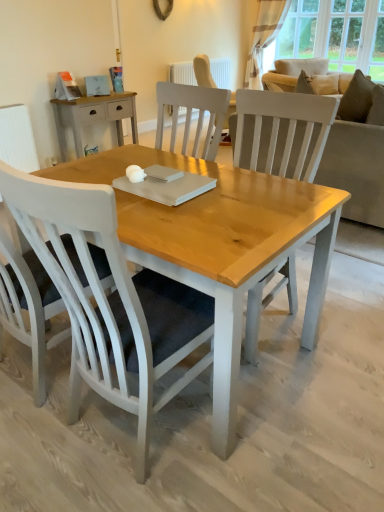
The width and height of the screenshot is (384, 512). Describe the element at coordinates (110, 300) in the screenshot. I see `white painted wood chair at center, arranged as the 1th chair when viewed from the right` at that location.

This screenshot has width=384, height=512. Describe the element at coordinates (358, 164) in the screenshot. I see `light beige fabric couch at upper right` at that location.

Describe the element at coordinates (29, 306) in the screenshot. This screenshot has width=384, height=512. I see `white painted wood chair at left, arranged as the 2th chair when viewed from the right` at that location.

Based on the photo, in order to face suede-like beige pillow at upper right, should I rotate leftwards or rightwards?

To align with it, rotate right about 22.322°.

The image size is (384, 512). What are the coordinates of `light brown wood desk at upper left` in the screenshot? It's located at (93, 117).

I want to click on white painted wood chair at center, marked as the 2th chair in a left-to-right arrangement, so click(x=110, y=300).

Looking at this image, from a real-world perspective, relative to white painted radiator at upper center, is striped fabric curtain at upper right vertically above or below?

striped fabric curtain at upper right is situated higher than white painted radiator at upper center in the real world.

From the image's perspective, is striped fabric curtain at upper right above white painted radiator at upper center?

Yes.

Is striped fabric curtain at upper right in front of or behind white painted radiator at upper center in the image?

striped fabric curtain at upper right is positioned farther from the viewer than white painted radiator at upper center.

Looking at this image, can you confirm if striped fabric curtain at upper right is shorter than white painted radiator at upper center?

In fact, striped fabric curtain at upper right may be taller than white painted radiator at upper center.

Is white painted wood chair at left, arranged as the 2th chair when viewed from the right, aimed at light beige fabric couch at upper right?

Yes, white painted wood chair at left, arranged as the 2th chair when viewed from the right, faces towards light beige fabric couch at upper right.

Is white painted wood chair at left, arranged as the 2th chair when viewed from the right, in front of or behind light beige fabric couch at upper right in the image?

white painted wood chair at left, arranged as the 2th chair when viewed from the right, is positioned closer to the viewer than light beige fabric couch at upper right.

Between white painted wood chair at left, the 1th chair viewed from the left, and light beige fabric couch at upper right, which one has less height?

Standing shorter between the two is light beige fabric couch at upper right.

Is white painted wood chair at left, arranged as the 2th chair when viewed from the right, inside the boundaries of light beige fabric couch at upper right, or outside?

white painted wood chair at left, arranged as the 2th chair when viewed from the right, lies outside light beige fabric couch at upper right.

How distant is light brown wood desk at upper left from striped fabric curtain at upper right?

light brown wood desk at upper left is 3.23 meters away from striped fabric curtain at upper right.

Is light brown wood desk at upper left not inside striped fabric curtain at upper right?

Yes, light brown wood desk at upper left is located beyond the bounds of striped fabric curtain at upper right.

Which point is more distant from viewer, [122,143] or [281,12]?

The point [281,12] is behind.

Considering the relative positions of light brown wood desk at upper left and striped fabric curtain at upper right in the image provided, is light brown wood desk at upper left to the left or to the right of striped fabric curtain at upper right?

light brown wood desk at upper left is positioned on striped fabric curtain at upper right's left side.

Consider the image. Is white painted wood chair at center, arranged as the 1th chair when viewed from the right, not close to suede-like beige pillow at upper right?

white painted wood chair at center, arranged as the 1th chair when viewed from the right, is far away from suede-like beige pillow at upper right.

Between white painted wood chair at center, marked as the 2th chair in a left-to-right arrangement, and suede-like beige pillow at upper right, which one has larger width?

white painted wood chair at center, marked as the 2th chair in a left-to-right arrangement.

Is point (49, 213) behind point (364, 81)?

No, (49, 213) is closer to viewer.

Who is bigger, white painted wood chair at center, marked as the 2th chair in a left-to-right arrangement, or suede-like beige pillow at upper right?

With larger size is white painted wood chair at center, marked as the 2th chair in a left-to-right arrangement.

Considering the relative sizes of light brown wood desk at upper left and white painted wood chair at center, marked as the 2th chair in a left-to-right arrangement, in the image provided, is light brown wood desk at upper left bigger than white painted wood chair at center, marked as the 2th chair in a left-to-right arrangement,?

No.

Do you think light brown wood desk at upper left is within white painted wood chair at center, marked as the 2th chair in a left-to-right arrangement, or outside of it?

light brown wood desk at upper left lies outside white painted wood chair at center, marked as the 2th chair in a left-to-right arrangement.

Considering the relative sizes of light brown wood desk at upper left and white painted wood chair at center, marked as the 2th chair in a left-to-right arrangement, in the image provided, is light brown wood desk at upper left taller than white painted wood chair at center, marked as the 2th chair in a left-to-right arrangement,?

In fact, light brown wood desk at upper left may be shorter than white painted wood chair at center, marked as the 2th chair in a left-to-right arrangement.

Is light brown wood desk at upper left not close to white painted wood chair at center, marked as the 2th chair in a left-to-right arrangement?

light brown wood desk at upper left is positioned a significant distance from white painted wood chair at center, marked as the 2th chair in a left-to-right arrangement.

In the scene shown: Between striped fabric curtain at upper right and white painted wood chair at center, marked as the 2th chair in a left-to-right arrangement, which one is positioned behind?

striped fabric curtain at upper right.

From a real-world perspective, is striped fabric curtain at upper right under white painted wood chair at center, arranged as the 1th chair when viewed from the right?

Actually, striped fabric curtain at upper right is physically above white painted wood chair at center, arranged as the 1th chair when viewed from the right, in the real world.

Which point is more distant from viewer, (270,19) or (69,229)?

Positioned behind is point (270,19).

Is striped fabric curtain at upper right taller than white painted wood chair at center, marked as the 2th chair in a left-to-right arrangement?

Yes, striped fabric curtain at upper right is taller than white painted wood chair at center, marked as the 2th chair in a left-to-right arrangement.

Considering the sizes of light brown wood desk at upper left and white painted radiator at upper center in the image, is light brown wood desk at upper left taller or shorter than white painted radiator at upper center?

light brown wood desk at upper left is shorter than white painted radiator at upper center.

Which object is thinner, light brown wood desk at upper left or white painted radiator at upper center?

white painted radiator at upper center is thinner.

Is light brown wood desk at upper left looking in the opposite direction of white painted radiator at upper center?

light brown wood desk at upper left is not turned away from white painted radiator at upper center.

From the picture: In the image, is light brown wood desk at upper left positioned in front of or behind white painted radiator at upper center?

light brown wood desk at upper left is in front of white painted radiator at upper center.

The height and width of the screenshot is (512, 384). There is a white painted radiator at upper center. In order to click on curtain above it (from a real-world perspective) in this screenshot , I will do `click(264, 33)`.

In order to click on studio couch that appears above the white painted wood chair at left, the 1th chair viewed from the left (from the image's perspective) in this screenshot , I will do `click(358, 164)`.

Looking at the image, which one is located closer to light brown wood desk at upper left, suede-like beige pillow at upper right or striped fabric curtain at upper right?

suede-like beige pillow at upper right is closer to light brown wood desk at upper left.

Based on their spatial positions, is light beige fabric couch at upper right or suede-like beige pillow at upper right closer to white painted wood chair at left, the 1th chair viewed from the left?

light beige fabric couch at upper right is closer to white painted wood chair at left, the 1th chair viewed from the left.

Considering their positions, is light brown wood desk at upper left positioned further to suede-like beige pillow at upper right than white painted wood chair at center, arranged as the 1th chair when viewed from the right?

The object further to suede-like beige pillow at upper right is white painted wood chair at center, arranged as the 1th chair when viewed from the right.

Estimate the real-world distances between objects in this image. Which object is further from light beige fabric couch at upper right, white painted radiator at upper center or striped fabric curtain at upper right?

striped fabric curtain at upper right.

When comparing their distances from white painted wood chair at left, arranged as the 2th chair when viewed from the right, does light brown wood desk at upper left or striped fabric curtain at upper right seem closer?

light brown wood desk at upper left lies closer to white painted wood chair at left, arranged as the 2th chair when viewed from the right, than the other object.

Estimate the real-world distances between objects in this image. Which object is further from light beige fabric couch at upper right, white painted radiator at upper center or white painted wood chair at left, the 1th chair viewed from the left?

Based on the image, white painted radiator at upper center appears to be further to light beige fabric couch at upper right.

Looking at the image, which one is located closer to suede-like beige pillow at upper right, light beige fabric couch at upper right or white painted radiator at upper center?

The object closer to suede-like beige pillow at upper right is light beige fabric couch at upper right.

Looking at the image, which one is located closer to suede-like beige pillow at upper right, white painted wood chair at left, the 1th chair viewed from the left, or white painted wood chair at center, arranged as the 1th chair when viewed from the right?

white painted wood chair at center, arranged as the 1th chair when viewed from the right, is positioned closer to the anchor suede-like beige pillow at upper right.

Locate an element on the screen. chair positioned between white painted wood chair at center, marked as the 2th chair in a left-to-right arrangement, and white painted radiator at upper center from near to far is located at coordinates 29,306.

The height and width of the screenshot is (512, 384). Identify the location of studio couch between white painted wood chair at center, arranged as the 1th chair when viewed from the right, and white painted radiator at upper center from front to back. (358, 164).

In order to click on chair between white painted wood chair at center, arranged as the 1th chair when viewed from the right, and light brown wood desk at upper left in the front-back direction in this screenshot , I will do `click(29, 306)`.

Where is `chair between white painted wood chair at center, marked as the 2th chair in a left-to-right arrangement, and suede-like beige pillow at upper right from front to back`? chair between white painted wood chair at center, marked as the 2th chair in a left-to-right arrangement, and suede-like beige pillow at upper right from front to back is located at coordinates (29, 306).